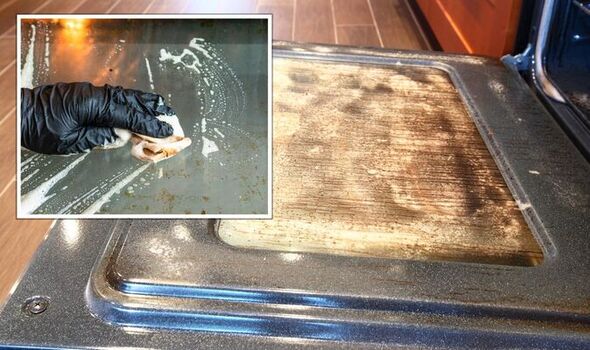
Where is `to the left of the oven`? to the left of the oven is located at coordinates (489, 19).